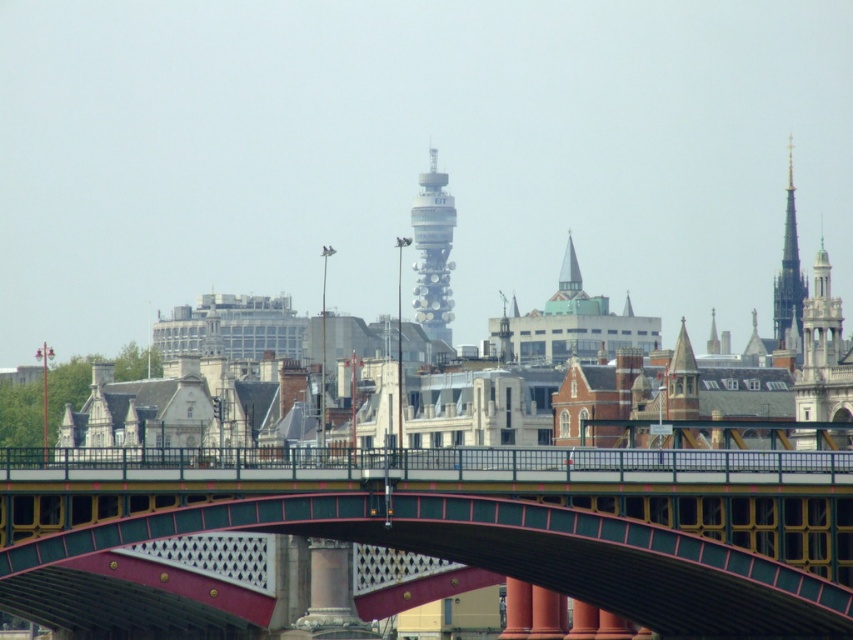
Which of these two, metallic red bridge at center or gold textured spire at upper right, stands taller?

Standing taller between the two is metallic red bridge at center.

Is metallic red bridge at center positioned in front of gold textured spire at upper right?

Yes, metallic red bridge at center is closer to the viewer.

Find the location of `metallic red bridge at center`. metallic red bridge at center is located at coordinates (431, 532).

Identify the location of metallic red bridge at center. (431, 532).

Is gold textured spire at upper right bigger than golden spire at upper right?

Actually, gold textured spire at upper right might be smaller than golden spire at upper right.

Does gold textured spire at upper right come behind golden spire at upper right?

No, it is not.

Is point (814, 388) closer to viewer compared to point (798, 289)?

Yes, point (814, 388) is closer to viewer.

Locate an element on the screen. This screenshot has width=853, height=640. gold textured spire at upper right is located at coordinates (822, 353).

Does silver metallic bt tower at center have a smaller size compared to golden spire at upper right?

Yes, silver metallic bt tower at center is smaller than golden spire at upper right.

From the picture: Does silver metallic bt tower at center have a lesser height compared to golden spire at upper right?

Yes.

Is point (439, 189) farther from viewer compared to point (788, 272)?

Yes, it is behind point (788, 272).

Locate an element on the screen. Image resolution: width=853 pixels, height=640 pixels. silver metallic bt tower at center is located at coordinates (432, 252).